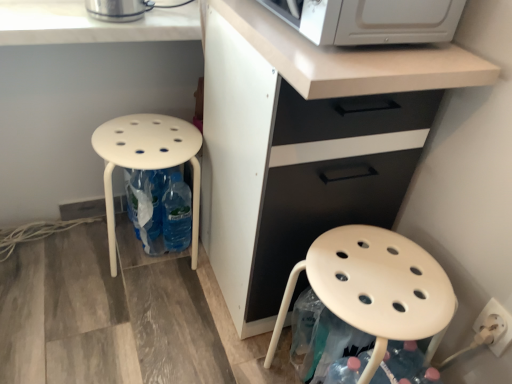
Locate an element on the screen. vacant space situated above white plastic stool at lower left, placed as the 2th stool when sorted from right to left (from a real-world perspective) is located at coordinates (144, 132).